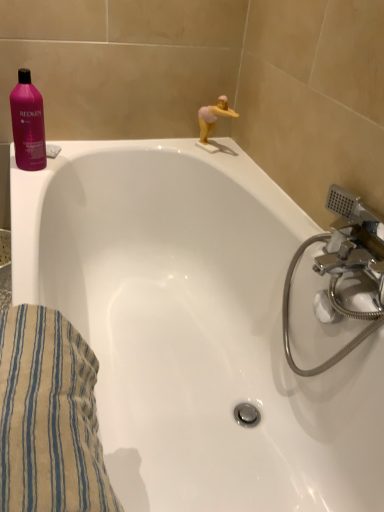
Question: From the image's perspective, is beige striped towel at lower left positioned above or below pink rubber duck at upper right?

Choices:
 (A) below
 (B) above

Answer: (A)

Question: Based on their positions, is beige striped towel at lower left located to the left or right of pink rubber duck at upper right?

Choices:
 (A) left
 (B) right

Answer: (A)

Question: Based on their relative distances, which object is farther from the pink rubber duck at upper right?

Choices:
 (A) pink glossy shampoo at upper left
 (B) beige striped towel at lower left
 (C) white glossy bathtub at upper left

Answer: (B)

Question: Considering the real-world distances, which object is closest to the pink glossy shampoo at upper left?

Choices:
 (A) pink rubber duck at upper right
 (B) beige striped towel at lower left
 (C) white glossy bathtub at upper left

Answer: (C)